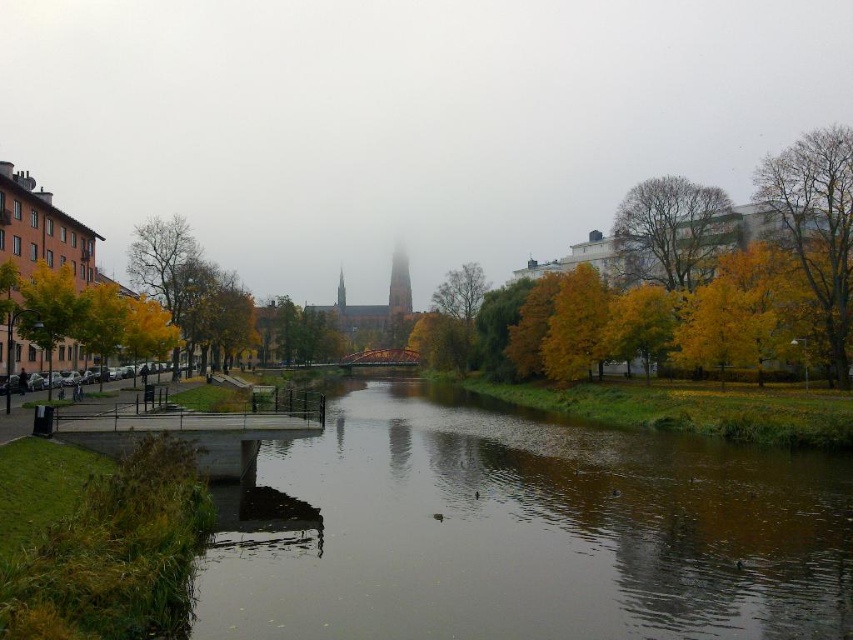
Question: Which object is farther from the camera taking this photo?

Choices:
 (A) yellow leafy tree at right
 (B) yellow matte tree at left

Answer: (A)

Question: Which point appears farthest from the camera in this image?

Choices:
 (A) (668, 186)
 (B) (561, 346)

Answer: (A)

Question: Does brown reflective water at center appear under yellow-green foliage at upper right?

Choices:
 (A) yes
 (B) no

Answer: (A)

Question: Does yellow-green foliage at upper right appear on the left side of yellow matte tree at center?

Choices:
 (A) no
 (B) yes

Answer: (A)

Question: Which object is farther from the camera taking this photo?

Choices:
 (A) yellow-green leafy tree at left
 (B) brown textured tree at right

Answer: (B)

Question: Can you confirm if brown reflective water at center is positioned below yellow-green leafy tree at left?

Choices:
 (A) no
 (B) yes

Answer: (B)